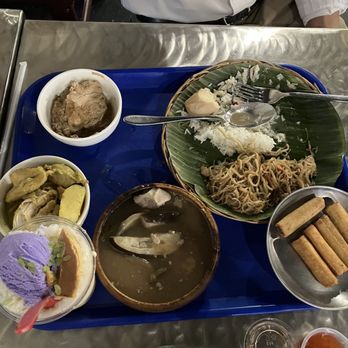
This screenshot has height=348, width=348. I want to click on sauce container, so click(308, 336), click(267, 337).